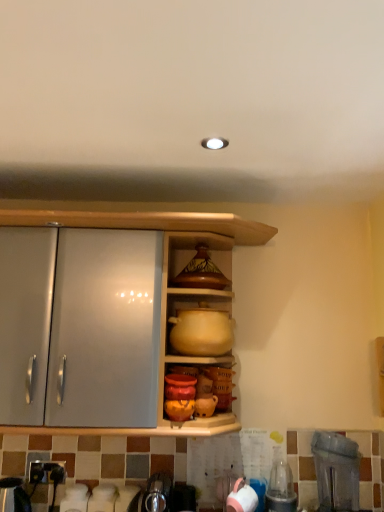
Question: Is transparent plastic blender at lower right, which ranks as the first appliance in right-to-left order, surrounded by matte brown ceramic pot at upper center?

Choices:
 (A) no
 (B) yes

Answer: (A)

Question: Does matte brown ceramic pot at upper center have a greater height compared to transparent plastic blender at lower right, which ranks as the first appliance in right-to-left order?

Choices:
 (A) yes
 (B) no

Answer: (B)

Question: Is matte brown ceramic pot at upper center aimed at transparent plastic blender at lower right, which ranks as the first appliance in right-to-left order?

Choices:
 (A) no
 (B) yes

Answer: (A)

Question: Can you confirm if matte brown ceramic pot at upper center is positioned to the right of transparent plastic blender at lower right, which is counted as the 2th appliance, starting from the left?

Choices:
 (A) no
 (B) yes

Answer: (A)

Question: Considering the relative sizes of matte brown ceramic pot at upper center and transparent plastic blender at lower right, which ranks as the first appliance in right-to-left order, in the image provided, is matte brown ceramic pot at upper center shorter than transparent plastic blender at lower right, which ranks as the first appliance in right-to-left order,?

Choices:
 (A) yes
 (B) no

Answer: (A)

Question: Do you think matte yellow clay pot at center is within matte brown ceramic pot at upper center, or outside of it?

Choices:
 (A) outside
 (B) inside

Answer: (A)

Question: From a real-world perspective, is matte yellow clay pot at center positioned above or below matte brown ceramic pot at upper center?

Choices:
 (A) above
 (B) below

Answer: (B)

Question: Looking at their shapes, would you say matte yellow clay pot at center is wider or thinner than matte brown ceramic pot at upper center?

Choices:
 (A) wide
 (B) thin

Answer: (A)

Question: From their relative heights in the image, would you say matte yellow clay pot at center is taller or shorter than matte brown ceramic pot at upper center?

Choices:
 (A) tall
 (B) short

Answer: (A)

Question: In terms of height, does pink matte cup at lower center look taller or shorter compared to matte yellow clay pot at center?

Choices:
 (A) short
 (B) tall

Answer: (A)

Question: Choose the correct answer: Is pink matte cup at lower center inside matte yellow clay pot at center or outside it?

Choices:
 (A) outside
 (B) inside

Answer: (A)

Question: In the image, is pink matte cup at lower center positioned in front of or behind matte yellow clay pot at center?

Choices:
 (A) front
 (B) behind

Answer: (A)

Question: Would you say pink matte cup at lower center is to the left or to the right of matte yellow clay pot at center in the picture?

Choices:
 (A) right
 (B) left

Answer: (A)

Question: Is point (223, 322) positioned closer to the camera than point (345, 490)?

Choices:
 (A) closer
 (B) farther

Answer: (B)

Question: Considering their positions, is matte yellow clay pot at center located in front of or behind transparent plastic blender at lower right, which is counted as the 2th appliance, starting from the left?

Choices:
 (A) behind
 (B) front

Answer: (A)